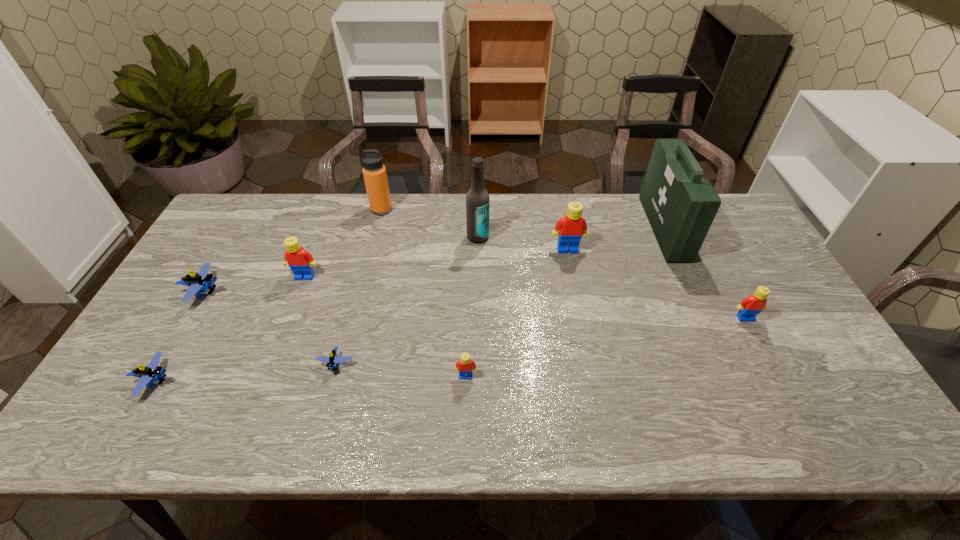
What are the coordinates of `beer bottle` in the screenshot? It's located at (477, 199).

Where is `the second object from right to left`? Image resolution: width=960 pixels, height=540 pixels. the second object from right to left is located at coordinates (680, 205).

Locate an element on the screen. the third tallest object is located at coordinates (374, 172).

The image size is (960, 540). In order to click on thermos bottle in this screenshot , I will do `click(374, 172)`.

Find the location of `the farthest red Lego`. the farthest red Lego is located at coordinates (569, 230).

I want to click on the third object from right to left, so click(x=569, y=230).

Locate an element on the screen. the sixth shortest object is located at coordinates (300, 261).

What are the coordinates of `the second tallest Lego` in the screenshot? It's located at (300, 261).

This screenshot has width=960, height=540. I want to click on the rightmost object, so click(x=750, y=306).

This screenshot has height=540, width=960. I want to click on the fourth nearest Lego, so click(x=750, y=306).